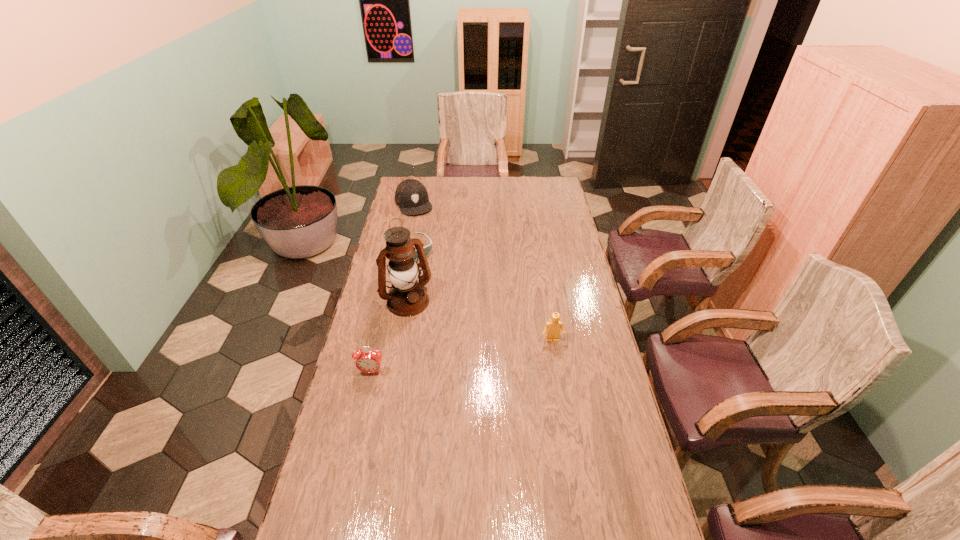
Where is `vacant region at the far right corner of the desktop`? The width and height of the screenshot is (960, 540). vacant region at the far right corner of the desktop is located at coordinates (554, 177).

I want to click on vacant point located between the Lego and the tallest object, so [x=480, y=321].

This screenshot has height=540, width=960. Identify the location of vacant space in between the cap and the goggles. [x=413, y=226].

This screenshot has width=960, height=540. What are the coordinates of `free space between the lantern and the nearest object` in the screenshot? It's located at (389, 336).

The image size is (960, 540). I want to click on object that can be found as the closest to the fourth nearest object, so click(407, 297).

Identify the location of object that is the third closest one to the cap. This screenshot has width=960, height=540. (554, 326).

Where is `vacant area that satisfies the following two spatial constraints: 1. on the front side of the third nearest object; 2. on the right side of the shortest object`? vacant area that satisfies the following two spatial constraints: 1. on the front side of the third nearest object; 2. on the right side of the shortest object is located at coordinates (402, 301).

Where is `free location that satisfies the following two spatial constraints: 1. on the front side of the farthest object; 2. on the left side of the goggles`? free location that satisfies the following two spatial constraints: 1. on the front side of the farthest object; 2. on the left side of the goggles is located at coordinates (404, 249).